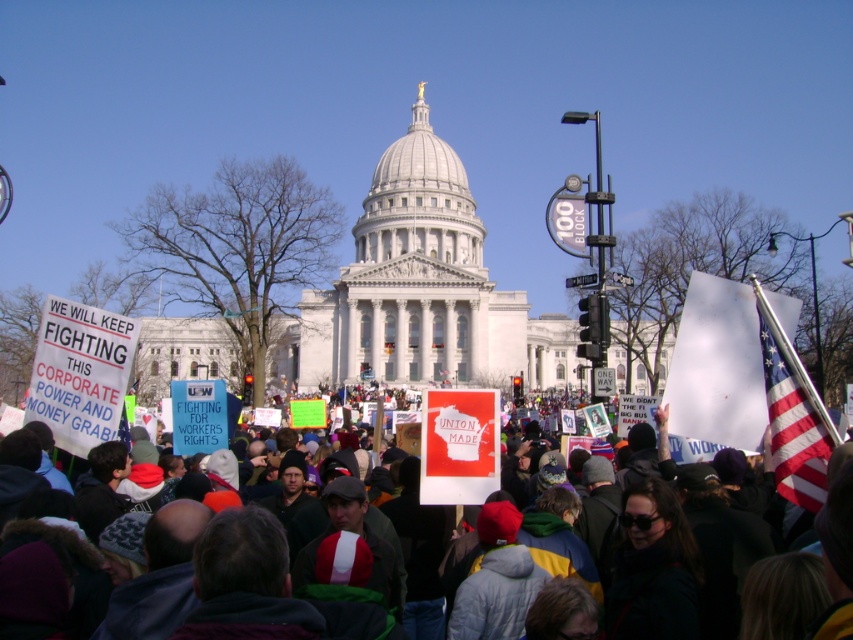
You are a photographer at the protest and want to capture both the white paper sign at center and the american flag at right in a single frame. Given their sizes, which object should you focus on to ensure both are clearly visible in your photo?

The white paper sign at center is bigger than the american flag at right. To ensure both are clearly visible, focus on the white paper sign at center since it is larger and will remain in focus while the smaller american flag at right will naturally be captured in the same frame.

From the picture: Based on the scene description, where is the white paper sign at center located in terms of coordinates?

The white paper sign at center is located at coordinates [689,566].

You are a photographer standing in the crowd trying to capture a photo that includes both the white paper sign at center and the american flag at right. The camera you are using has a lens that can only focus on objects within a 5 meter range. Will you be able to get both objects in focus at the same time?

The white paper sign at center and the american flag at right are 7.43 meters apart from each other. Since the camera can only focus within a 5 meter range, the distance between them exceeds this limit, so you cannot get both in focus simultaneously.